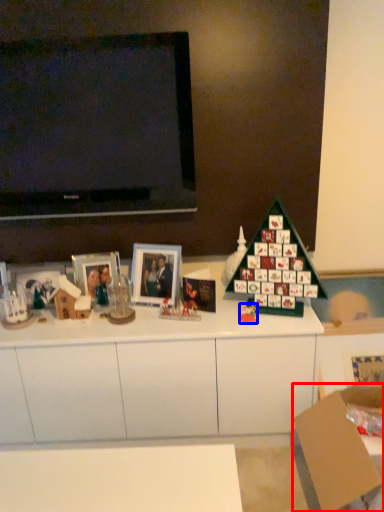
Question: Which point is closer to the camera, cardboard box (highlighted by a red box) or toy (highlighted by a blue box)?

Choices:
 (A) cardboard box
 (B) toy

Answer: (A)